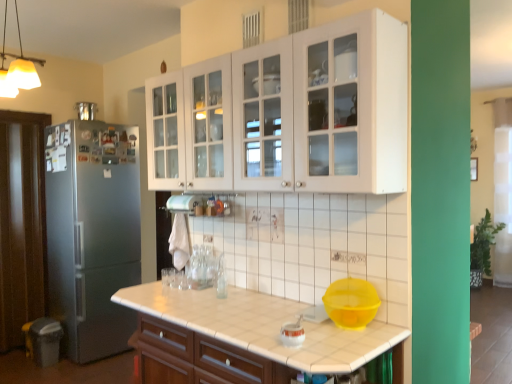
Question: Are brushed metal refrigerator at left, which is the second appliance in front-to-back order, and white glossy kettle at center, positioned as the 1th appliance in bottom-to-top order, located far from each other?

Choices:
 (A) yes
 (B) no

Answer: (A)

Question: From the image's perspective, is brushed metal refrigerator at left, placed as the first appliance when sorted from top to bottom, below white glossy kettle at center, which appears as the first appliance when viewed from the front?

Choices:
 (A) no
 (B) yes

Answer: (A)

Question: From the image's perspective, is brushed metal refrigerator at left, which is the second appliance in front-to-back order, located above white glossy kettle at center, arranged as the second appliance when viewed from the back?

Choices:
 (A) no
 (B) yes

Answer: (B)

Question: Does brushed metal refrigerator at left, arranged as the second appliance when viewed from the right, have a greater height compared to white glossy kettle at center, marked as the first appliance in a right-to-left arrangement?

Choices:
 (A) yes
 (B) no

Answer: (A)

Question: Does brushed metal refrigerator at left, placed as the first appliance when sorted from top to bottom, appear on the left side of white glossy kettle at center, positioned as the 2th appliance in top-to-bottom order?

Choices:
 (A) no
 (B) yes

Answer: (B)

Question: Relative to white glossy kettle at center, arranged as the second appliance when viewed from the back, is matte white countertop at center, marked as the 1th cabinetry in a bottom-to-top arrangement, in front or behind?

Choices:
 (A) behind
 (B) front

Answer: (B)

Question: Looking at their shapes, would you say matte white countertop at center, the 2th cabinetry from the top, is wider or thinner than white glossy kettle at center, marked as the first appliance in a right-to-left arrangement?

Choices:
 (A) thin
 (B) wide

Answer: (B)

Question: Is point (139, 374) positioned closer to the camera than point (298, 331)?

Choices:
 (A) closer
 (B) farther

Answer: (B)

Question: Based on their sizes in the image, would you say matte white countertop at center, the 2th cabinetry from the top, is bigger or smaller than white glossy kettle at center, arranged as the second appliance when viewed from the back?

Choices:
 (A) small
 (B) big

Answer: (B)

Question: Is white glossy cabinet at upper center, arranged as the 2th cabinetry when ordered from the bottom, to the left or to the right of matte white countertop at center, marked as the 1th cabinetry in a bottom-to-top arrangement, in the image?

Choices:
 (A) right
 (B) left

Answer: (A)

Question: Considering the positions of point (266, 173) and point (394, 342), is point (266, 173) closer or farther from the camera than point (394, 342)?

Choices:
 (A) farther
 (B) closer

Answer: (A)

Question: From a real-world perspective, is white glossy cabinet at upper center, arranged as the 2th cabinetry when ordered from the bottom, positioned above or below matte white countertop at center, marked as the 1th cabinetry in a bottom-to-top arrangement?

Choices:
 (A) below
 (B) above

Answer: (B)

Question: From the image's perspective, is white glossy cabinet at upper center, arranged as the 2th cabinetry when ordered from the bottom, positioned above or below matte white countertop at center, marked as the 1th cabinetry in a bottom-to-top arrangement?

Choices:
 (A) above
 (B) below

Answer: (A)

Question: Is point (78, 110) closer or farther from the camera than point (249, 372)?

Choices:
 (A) closer
 (B) farther

Answer: (B)

Question: From the image's perspective, is brushed metal refrigerator at left, acting as the second appliance starting from the bottom, above or below matte white countertop at center, marked as the 1th cabinetry in a bottom-to-top arrangement?

Choices:
 (A) below
 (B) above

Answer: (B)